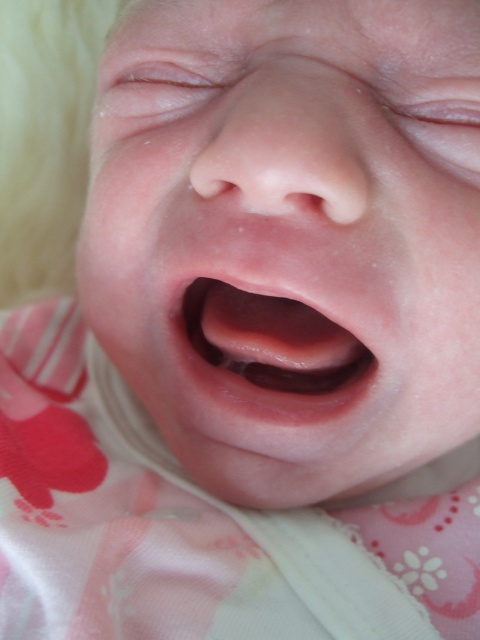
Is pink smooth skin at center smaller than pink fabric at center?

No, pink smooth skin at center is not smaller than pink fabric at center.

Which is in front, point (288, 388) or point (194, 528)?

Point (288, 388)

This screenshot has height=640, width=480. What do you see at coordinates (292, 241) in the screenshot?
I see `pink smooth skin at center` at bounding box center [292, 241].

Locate an element on the screen. Image resolution: width=480 pixels, height=640 pixels. pink smooth skin at center is located at coordinates (292, 241).

How far apart are pink smooth skin at center and pink smooth flesh at center?

pink smooth skin at center and pink smooth flesh at center are 2.54 inches apart from each other.

This screenshot has height=640, width=480. Identify the location of pink smooth skin at center. (292, 241).

Can you confirm if pink fabric at center is smaller than pink smooth flesh at center?

Incorrect, pink fabric at center is not smaller in size than pink smooth flesh at center.

Does pink fabric at center have a larger size compared to pink smooth flesh at center?

Yes.

You are a GUI agent. You are given a task and a screenshot of the screen. Output one action in this format:
    pyautogui.click(x=<x>, y=<y>)
    Task: Click on the pink fabric at center
    The width and height of the screenshot is (480, 640).
    Given the screenshot: What is the action you would take?
    pyautogui.click(x=192, y=525)

Locate an element on the screen. The image size is (480, 640). pink fabric at center is located at coordinates (192, 525).